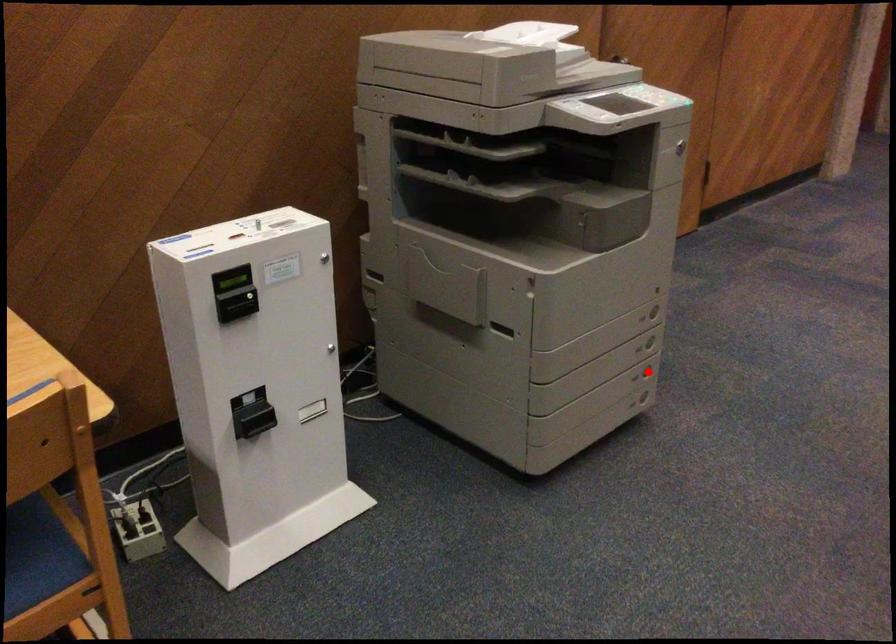
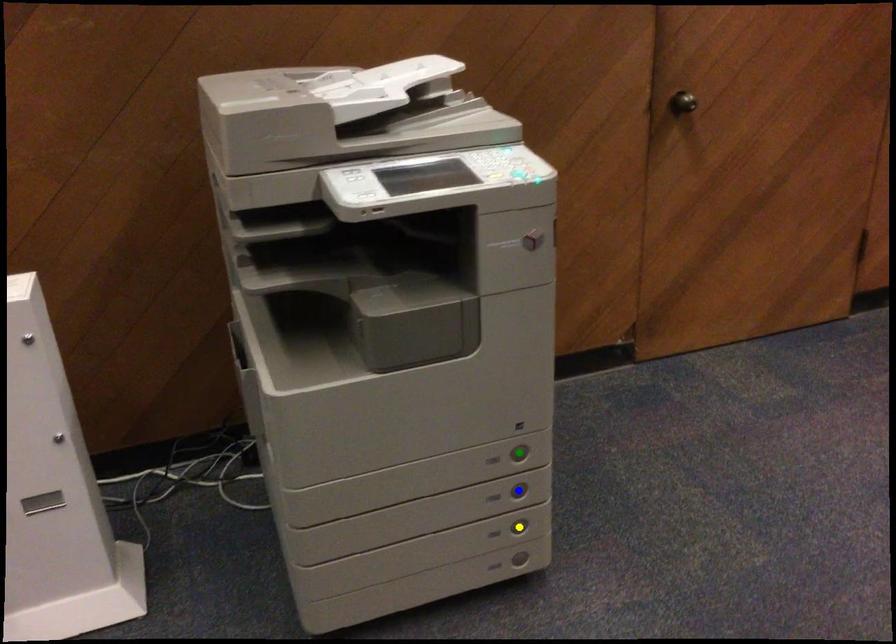
Question: I am providing you with two images of the same scene from different viewpoints. A red point is marked on the first image. You are given multiple points on the second image. Which spot in image 2 lines up with the point in image 1?

Choices:
 (A) green point
 (B) blue point
 (C) yellow point

Answer: (C)